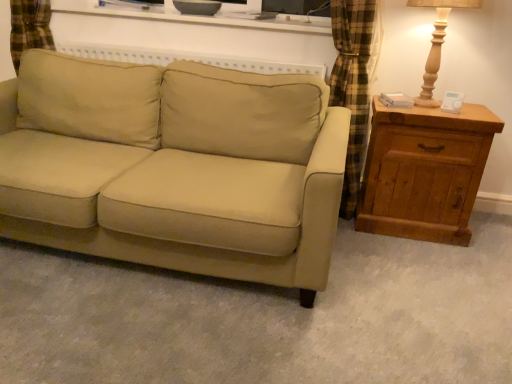
Where is `free location in front of wooden chest of drawers at right`? free location in front of wooden chest of drawers at right is located at coordinates (418, 262).